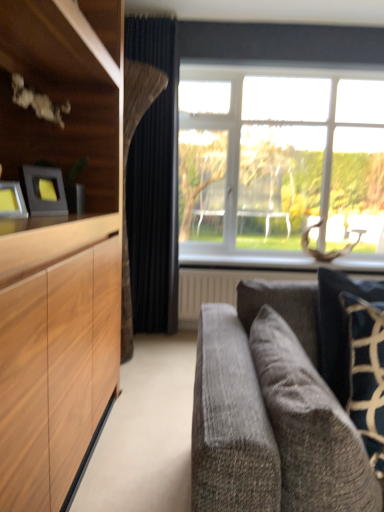
Identify the location of free space above dark blue velvet curtain at center (from a real-world perspective). (158, 11).